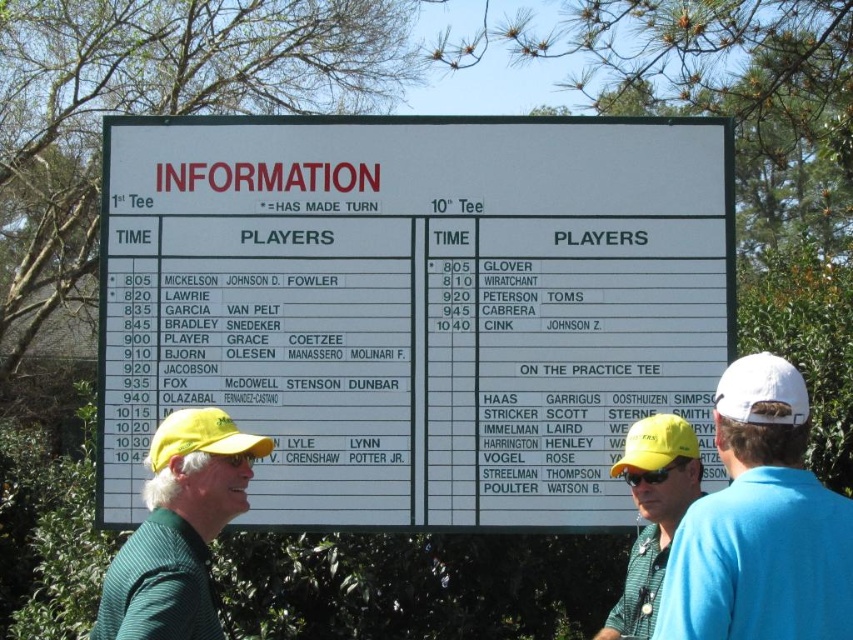
You are a spectator at the golf tournament and want to see both the white plastic sign at center and the yellow matte baseball cap at center. Which one is positioned higher?

The white plastic sign at center is located above the yellow matte baseball cap at center, so it is positioned higher.

You are a spectator at the golf tournament and want to know where the white plastic sign at center and the yellow fabric cap at center are located relative to each other. Which one is bigger?

The white plastic sign at center is larger in size than the yellow fabric cap at center.